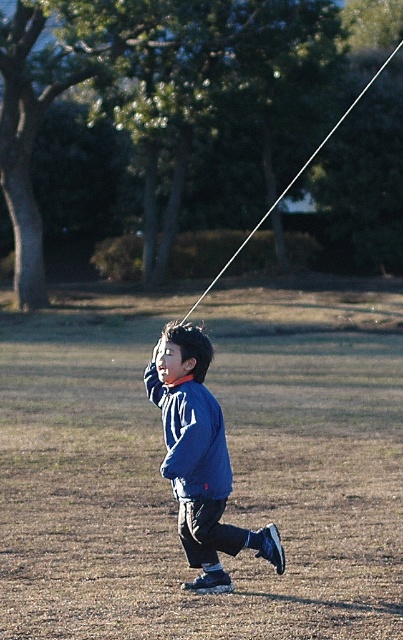
Question: Which object appears closest to the camera in this image?

Choices:
 (A) blue matte jacket at center
 (B) matte blue jacket at center

Answer: (A)

Question: Where is blue matte jacket at center located in relation to white string at upper center in the image?

Choices:
 (A) left
 (B) right

Answer: (A)

Question: Which of the following is the closest to the observer?

Choices:
 (A) (392, 54)
 (B) (184, 416)

Answer: (B)

Question: Does blue matte jacket at center appear over white string at upper center?

Choices:
 (A) yes
 (B) no

Answer: (B)

Question: Can you confirm if blue matte jacket at center is positioned below white string at upper center?

Choices:
 (A) no
 (B) yes

Answer: (B)

Question: Which is nearer to the white string at upper center?

Choices:
 (A) matte blue jacket at center
 (B) blue matte jacket at center

Answer: (B)